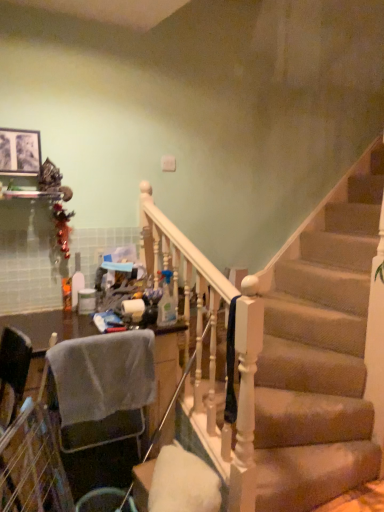
Question: Is translucent plastic spray bottle at center, which ranks as the 1th bottle in right-to-left order, wider than matte black picture frame at upper left?

Choices:
 (A) no
 (B) yes

Answer: (B)

Question: Is matte black picture frame at upper left located within translucent plastic spray bottle at center, the 2th bottle from the back?

Choices:
 (A) yes
 (B) no

Answer: (B)

Question: From a real-world perspective, is translucent plastic spray bottle at center, the 2th bottle from the back, positioned over matte black picture frame at upper left based on gravity?

Choices:
 (A) yes
 (B) no

Answer: (B)

Question: Does translucent plastic spray bottle at center, the first bottle viewed from the front, lie behind matte black picture frame at upper left?

Choices:
 (A) yes
 (B) no

Answer: (B)

Question: Is translucent plastic spray bottle at center, placed as the 2th bottle when sorted from left to right, oriented towards matte black picture frame at upper left?

Choices:
 (A) yes
 (B) no

Answer: (B)

Question: From a real-world perspective, relative to matte black picture frame at upper left, is translucent plastic bottle at center, which ranks as the first bottle in back-to-front order, vertically above or below?

Choices:
 (A) above
 (B) below

Answer: (B)

Question: Does point [x=74, y=300] appear closer or farther from the camera than point [x=23, y=137]?

Choices:
 (A) closer
 (B) farther

Answer: (B)

Question: In terms of height, does translucent plastic bottle at center, arranged as the 2th bottle when viewed from the front, look taller or shorter compared to matte black picture frame at upper left?

Choices:
 (A) tall
 (B) short

Answer: (A)

Question: Is translucent plastic bottle at center, which ranks as the first bottle in back-to-front order, in front of or behind matte black picture frame at upper left in the image?

Choices:
 (A) front
 (B) behind

Answer: (B)

Question: Relative to metallic silver trash bin/can at lower left, is translucent plastic bottle at center, which ranks as the first bottle in back-to-front order, in front or behind?

Choices:
 (A) behind
 (B) front

Answer: (A)

Question: Is translucent plastic bottle at center, positioned as the 2th bottle in right-to-left order, wider or thinner than metallic silver trash bin/can at lower left?

Choices:
 (A) thin
 (B) wide

Answer: (A)

Question: Considering the positions of point (82, 279) and point (82, 496), is point (82, 279) closer or farther from the camera than point (82, 496)?

Choices:
 (A) farther
 (B) closer

Answer: (A)

Question: Is translucent plastic bottle at center, arranged as the 2th bottle when viewed from the front, situated inside metallic silver trash bin/can at lower left or outside?

Choices:
 (A) outside
 (B) inside

Answer: (A)

Question: From a real-world perspective, is metallic silver trash bin/can at lower left positioned above or below translucent plastic spray bottle at center, placed as the 2th bottle when sorted from left to right?

Choices:
 (A) above
 (B) below

Answer: (B)

Question: Is metallic silver trash bin/can at lower left wider or thinner than translucent plastic spray bottle at center, the first bottle viewed from the front?

Choices:
 (A) wide
 (B) thin

Answer: (A)